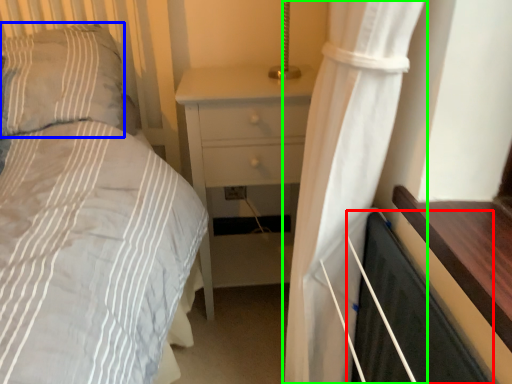
Question: Which object is positioned closest to screen door (highlighted by a red box)? Select from pillow (highlighted by a blue box) and curtain (highlighted by a green box).

Choices:
 (A) pillow
 (B) curtain

Answer: (B)